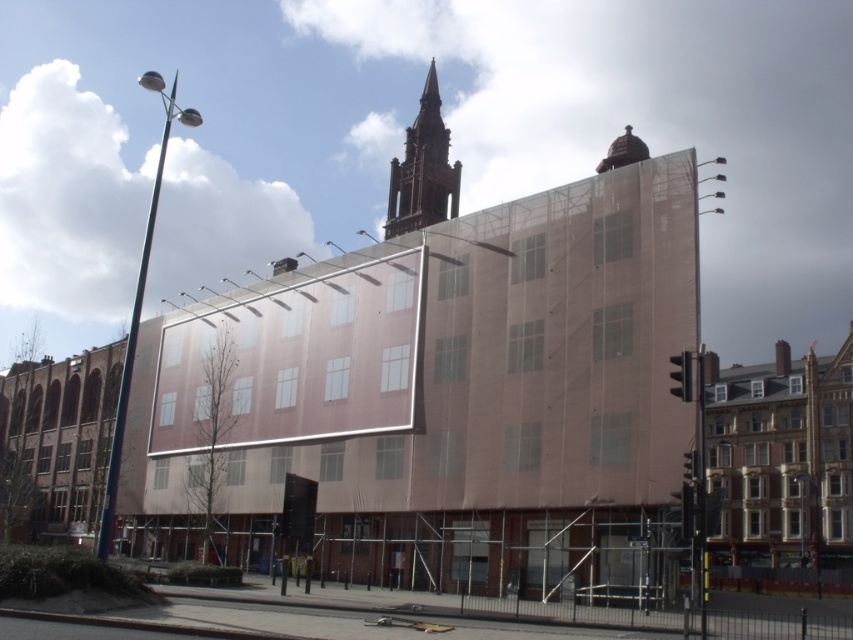
Which of these two, golden stone church at right or brown stone tower at upper center, stands shorter?

Standing shorter between the two is golden stone church at right.

Is point (730, 552) positioned after point (415, 218)?

No, it is in front of (415, 218).

Find the location of `golden stone church at right`. golden stone church at right is located at coordinates (781, 458).

Can you confirm if brown stone church at center is positioned to the right of golden stone church at right?

In fact, brown stone church at center is to the left of golden stone church at right.

Does point (606, 202) lie behind point (727, 388)?

No, it is not.

Locate an element on the screen. This screenshot has width=853, height=640. brown stone church at center is located at coordinates (440, 397).

Is brown stone church at center shorter than brown stone tower at upper center?

Incorrect, brown stone church at center's height does not fall short of brown stone tower at upper center's.

Does brown stone church at center appear under brown stone tower at upper center?

Indeed, brown stone church at center is positioned under brown stone tower at upper center.

Between point (364, 497) and point (405, 186), which one is positioned behind?

The point (405, 186) is behind.

You are a GUI agent. You are given a task and a screenshot of the screen. Output one action in this format:
    pyautogui.click(x=<x>, y=<y>)
    Task: Click on the brown stone church at center
    Image resolution: width=853 pixels, height=640 pixels.
    Given the screenshot: What is the action you would take?
    440,397